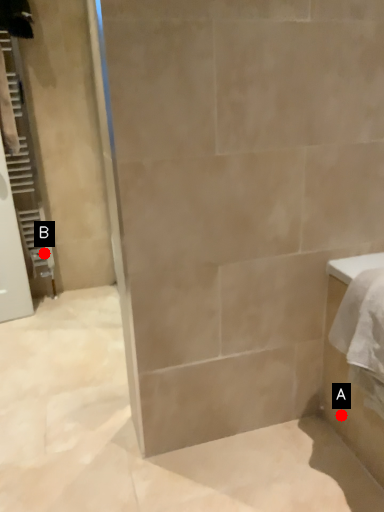
Question: Two points are circled on the image, labeled by A and B beside each circle. Among these points, which one is farthest from the camera?

Choices:
 (A) A is further
 (B) B is further

Answer: (B)